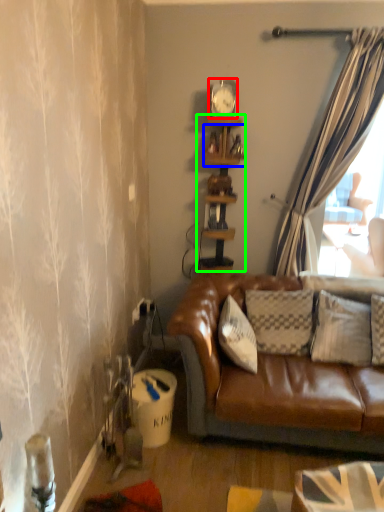
Question: Estimate the real-world distances between objects in this image. Which object is closer to clock (highlighted by a red box), shelf (highlighted by a blue box) or shelf (highlighted by a green box)?

Choices:
 (A) shelf
 (B) shelf

Answer: (A)